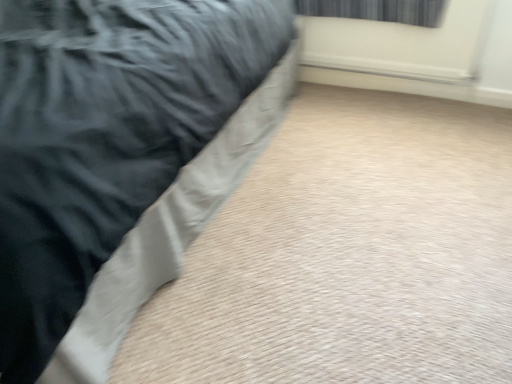
Locate an element on the screen. satin black bed at left is located at coordinates (105, 136).

Describe the element at coordinates (105, 136) in the screenshot. The height and width of the screenshot is (384, 512). I see `satin black bed at left` at that location.

Where is `dark gray fabric curtain at upper right`? Image resolution: width=512 pixels, height=384 pixels. dark gray fabric curtain at upper right is located at coordinates (376, 10).

What do you see at coordinates (376, 10) in the screenshot?
I see `dark gray fabric curtain at upper right` at bounding box center [376, 10].

This screenshot has height=384, width=512. Identify the location of satin black bed at left. (105, 136).

Considering the relative positions of satin black bed at left and dark gray fabric curtain at upper right in the image provided, is satin black bed at left to the left or to the right of dark gray fabric curtain at upper right?

From the image, it's evident that satin black bed at left is to the left of dark gray fabric curtain at upper right.

Is satin black bed at left further to the viewer compared to dark gray fabric curtain at upper right?

No, satin black bed at left is closer to the viewer.

Considering the points (48, 224) and (395, 3), which point is behind, point (48, 224) or point (395, 3)?

The point (395, 3) is farther.

From the image's perspective, between satin black bed at left and dark gray fabric curtain at upper right, who is located below?

satin black bed at left.

From a real-world perspective, is satin black bed at left physically above dark gray fabric curtain at upper right?

Actually, satin black bed at left is physically below dark gray fabric curtain at upper right in the real world.

Is satin black bed at left thinner than dark gray fabric curtain at upper right?

No, satin black bed at left is not thinner than dark gray fabric curtain at upper right.

Is satin black bed at left shorter than dark gray fabric curtain at upper right?

Incorrect, the height of satin black bed at left does not fall short of that of dark gray fabric curtain at upper right.

Does satin black bed at left have a larger size compared to dark gray fabric curtain at upper right?

Correct, satin black bed at left is larger in size than dark gray fabric curtain at upper right.

Is satin black bed at left located outside dark gray fabric curtain at upper right?

Yes, satin black bed at left is located beyond the bounds of dark gray fabric curtain at upper right.

Consider the image. Is satin black bed at left far from dark gray fabric curtain at upper right?

Yes, satin black bed at left is far from dark gray fabric curtain at upper right.

Consider the image. Is satin black bed at left positioned with its back to dark gray fabric curtain at upper right?

satin black bed at left does not have its back to dark gray fabric curtain at upper right.

Can you tell me how much satin black bed at left and dark gray fabric curtain at upper right differ in facing direction?

The angular difference between satin black bed at left and dark gray fabric curtain at upper right is 0.753 degrees.

Measure the distance from satin black bed at left to dark gray fabric curtain at upper right.

satin black bed at left and dark gray fabric curtain at upper right are 4.13 feet apart from each other.

Image resolution: width=512 pixels, height=384 pixels. What are the coordinates of `bed in front of the dark gray fabric curtain at upper right` in the screenshot? It's located at (105, 136).

Is dark gray fabric curtain at upper right to the right of satin black bed at left from the viewer's perspective?

Yes, dark gray fabric curtain at upper right is to the right of satin black bed at left.

In the image, is dark gray fabric curtain at upper right positioned in front of or behind satin black bed at left?

Clearly, dark gray fabric curtain at upper right is behind satin black bed at left.

Does point (375, 17) appear closer or farther from the camera than point (13, 244)?

Point (375, 17) is positioned farther from the camera compared to point (13, 244).

From the image's perspective, which one is positioned higher, dark gray fabric curtain at upper right or satin black bed at left?

dark gray fabric curtain at upper right is shown above in the image.

From a real-world perspective, is dark gray fabric curtain at upper right positioned above or below satin black bed at left?

dark gray fabric curtain at upper right is situated higher than satin black bed at left in the real world.

Is dark gray fabric curtain at upper right wider or thinner than satin black bed at left?

dark gray fabric curtain at upper right is thinner than satin black bed at left.

Consider the image. Which of these two, dark gray fabric curtain at upper right or satin black bed at left, stands taller?

satin black bed at left.

Looking at the image, does dark gray fabric curtain at upper right seem bigger or smaller compared to satin black bed at left?

Clearly, dark gray fabric curtain at upper right is smaller in size than satin black bed at left.

Which is correct: dark gray fabric curtain at upper right is inside satin black bed at left, or outside of it?

dark gray fabric curtain at upper right is located beyond the bounds of satin black bed at left.

Can you see dark gray fabric curtain at upper right touching satin black bed at left?

There is a gap between dark gray fabric curtain at upper right and satin black bed at left.

From the picture: Is dark gray fabric curtain at upper right facing towards satin black bed at left?

Yes, dark gray fabric curtain at upper right is aimed at satin black bed at left.

The image size is (512, 384). In the image, there is a dark gray fabric curtain at upper right. Identify the location of bed below it (from a real-world perspective). (105, 136).

Image resolution: width=512 pixels, height=384 pixels. In order to click on curtain above the satin black bed at left (from the image's perspective) in this screenshot , I will do `click(376, 10)`.

Identify the location of bed that appears on the left of dark gray fabric curtain at upper right. The height and width of the screenshot is (384, 512). (105, 136).